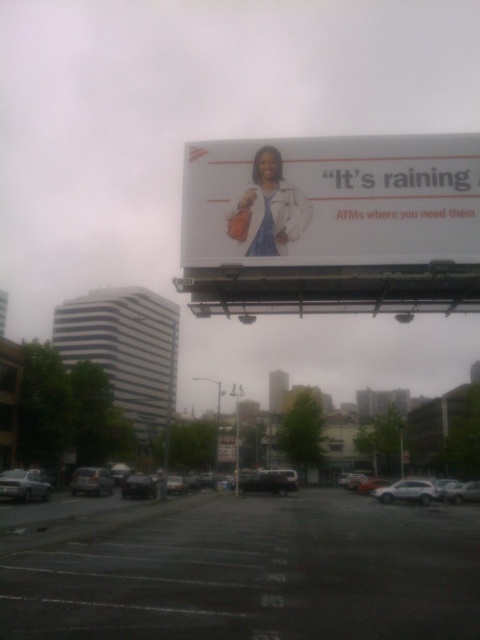
Question: Is white paper billboard at upper center thinner than white matte billboard at upper center?

Choices:
 (A) yes
 (B) no

Answer: (B)

Question: Among these points, which one is nearest to the camera?

Choices:
 (A) (382, 209)
 (B) (260, 488)
 (C) (391, 488)

Answer: (A)

Question: Which object is closer to the camera taking this photo?

Choices:
 (A) white matte billboard at upper center
 (B) metallic silver sedan at lower left
 (C) silver metallic sedan at lower right

Answer: (B)

Question: Does metallic silver sedan at lower left appear on the left side of white matte billboard at upper center?

Choices:
 (A) no
 (B) yes

Answer: (B)

Question: Where is silver metallic sedan at lower left located in relation to white matte billboard at upper center in the image?

Choices:
 (A) above
 (B) below

Answer: (A)

Question: Which object appears closest to the camera in this image?

Choices:
 (A) white matte car at lower right
 (B) white paper billboard at upper center
 (C) silver metallic sedan at lower left
 (D) white matte billboard at upper center

Answer: (B)